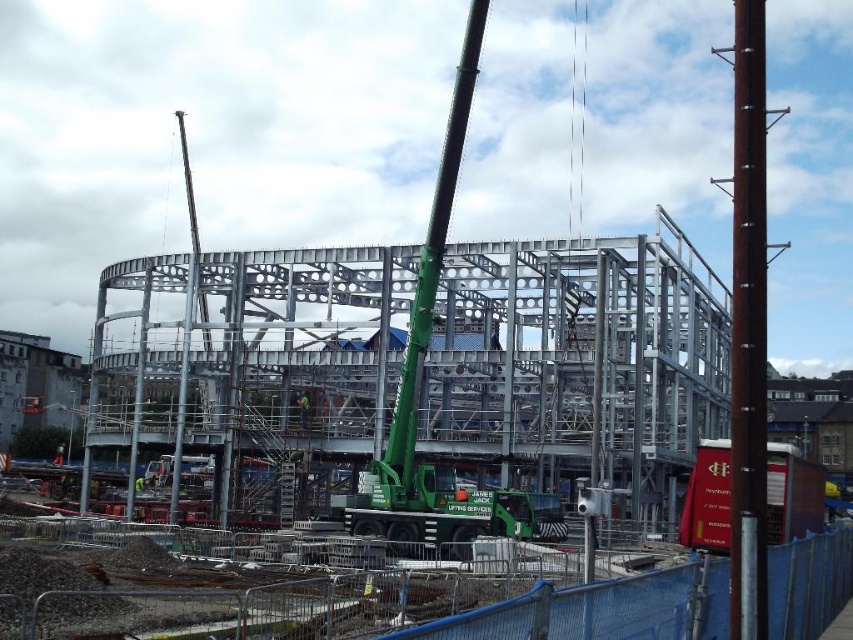
You are a construction worker standing at the center of the construction site. You see a point marked at coordinate (418, 376). What object is located at that point?

The point at coordinate (418, 376) corresponds to the green metallic crane at center.

You are a construction inspector standing at the edge of the site. You need to check the safety of both the green metallic crane at center and the green fabric construction worker at center. Which object should you inspect first based on their positions?

The green metallic crane at center is closer to the viewer than the green fabric construction worker at center, so you should inspect the green metallic crane at center first since it is nearer to your current position.